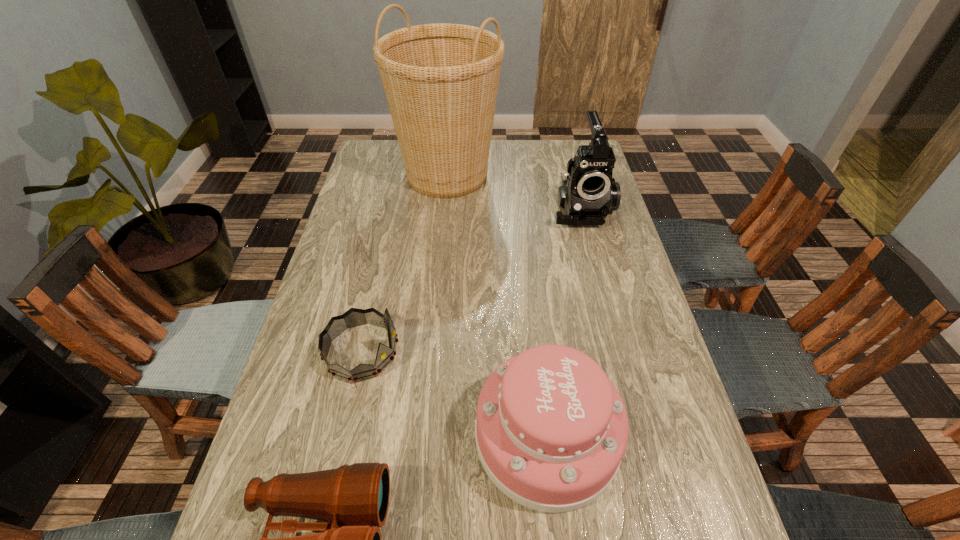
Image resolution: width=960 pixels, height=540 pixels. Identify the location of tiara that is at the left edge. (353, 317).

The width and height of the screenshot is (960, 540). Find the location of `camcorder at the right edge`. camcorder at the right edge is located at coordinates (588, 192).

This screenshot has width=960, height=540. What are the coordinates of `birthday cake present at the right edge` in the screenshot? It's located at (551, 429).

I want to click on object present at the far left corner, so click(441, 81).

Where is `free space at the left edge`? This screenshot has width=960, height=540. free space at the left edge is located at coordinates (353, 396).

In the image, there is a desktop. Find the location of `vacant space at the right edge`. vacant space at the right edge is located at coordinates pyautogui.click(x=641, y=450).

In order to click on unoccupied area between the basket and the tiara in this screenshot , I will do `click(404, 263)`.

Where is `free space between the tiara and the second tallest object`? The image size is (960, 540). free space between the tiara and the second tallest object is located at coordinates (471, 279).

Where is `free area in between the fourth shortest object and the tallest object`? free area in between the fourth shortest object and the tallest object is located at coordinates (515, 192).

Identify the location of blank region between the birthday cake and the basket. This screenshot has width=960, height=540. (496, 306).